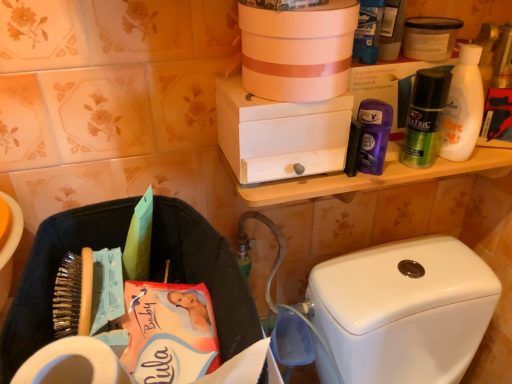
Question: Should I look upward or downward to see white matte box at upper center, the second box viewed from the top?

Choices:
 (A) down
 (B) up

Answer: (B)

Question: Does green matte deodorant at upper right, the 2th toiletry when ordered from left to right, have a greater height compared to white matte bottle at upper right?

Choices:
 (A) no
 (B) yes

Answer: (A)

Question: Can you confirm if green matte deodorant at upper right, the 2th toiletry when ordered from left to right, is positioned to the right of white matte bottle at upper right?

Choices:
 (A) yes
 (B) no

Answer: (B)

Question: From the image's perspective, is green matte deodorant at upper right, the 2th toiletry when ordered from left to right, beneath white matte bottle at upper right?

Choices:
 (A) no
 (B) yes

Answer: (B)

Question: Is green matte deodorant at upper right, which is counted as the 1th toiletry, starting from the right, oriented away from white matte bottle at upper right?

Choices:
 (A) yes
 (B) no

Answer: (B)

Question: Is green matte deodorant at upper right, which is counted as the 1th toiletry, starting from the right, thinner than white matte bottle at upper right?

Choices:
 (A) no
 (B) yes

Answer: (B)

Question: From the image's perspective, is green matte deodorant at upper right, the 2th toiletry when ordered from left to right, located above white matte bottle at upper right?

Choices:
 (A) yes
 (B) no

Answer: (B)

Question: Is purple glossy deodorant at upper right, the 2th toiletry when ordered from right to left, positioned far away from black fabric laundry basket at lower left?

Choices:
 (A) no
 (B) yes

Answer: (A)

Question: From the image's perspective, would you say purple glossy deodorant at upper right, the 2th toiletry when ordered from right to left, is positioned over black fabric laundry basket at lower left?

Choices:
 (A) no
 (B) yes

Answer: (B)

Question: From the image's perspective, is purple glossy deodorant at upper right, arranged as the first toiletry when viewed from the left, beneath black fabric laundry basket at lower left?

Choices:
 (A) no
 (B) yes

Answer: (A)

Question: Is purple glossy deodorant at upper right, arranged as the first toiletry when viewed from the left, shorter than black fabric laundry basket at lower left?

Choices:
 (A) yes
 (B) no

Answer: (A)

Question: Is the depth of purple glossy deodorant at upper right, the 2th toiletry when ordered from right to left, greater than that of black fabric laundry basket at lower left?

Choices:
 (A) no
 (B) yes

Answer: (B)

Question: Can you see purple glossy deodorant at upper right, arranged as the first toiletry when viewed from the left, touching black fabric laundry basket at lower left?

Choices:
 (A) no
 (B) yes

Answer: (A)

Question: Is white matte container at upper right far away from white matte toilet paper at lower left?

Choices:
 (A) yes
 (B) no

Answer: (B)